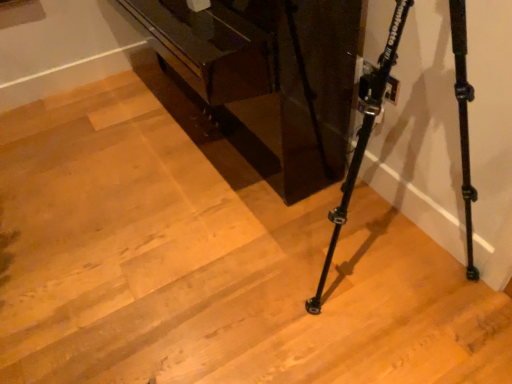
Identify the location of free area below black matte tripod at lower right (from a real-world perspective). The height and width of the screenshot is (384, 512). tap(360, 267).